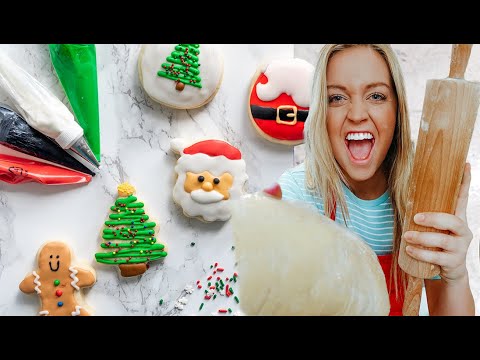
You are a GUI agent. You are given a task and a screenshot of the screen. Output one action in this format:
    pyautogui.click(x=<x>, y=<y>)
    Task: Click on the rolling pin
    The image size is (480, 360).
    Given the screenshot: What is the action you would take?
    pyautogui.click(x=442, y=130)